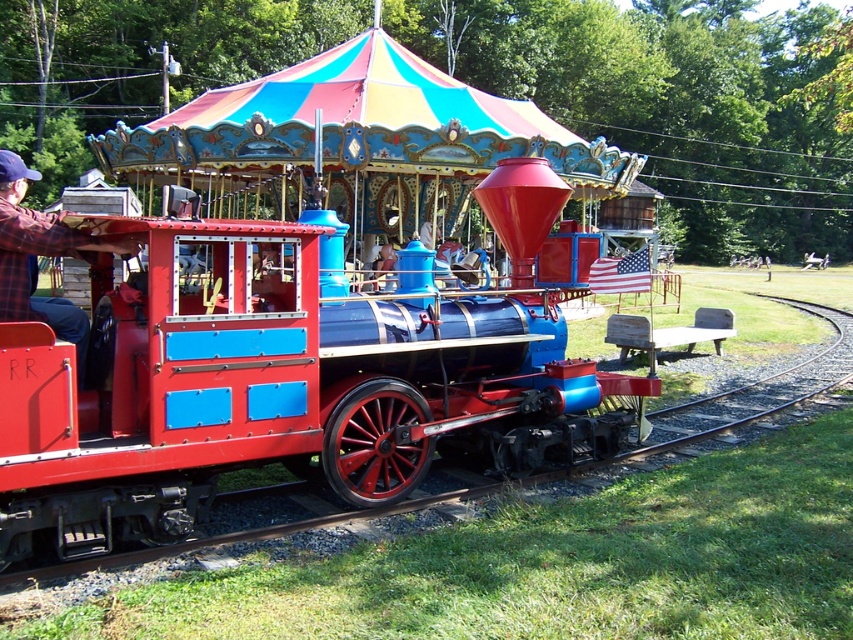
Question: In this image, where is shiny red locomotive at center located relative to plaid flannel shirt at left?

Choices:
 (A) left
 (B) right

Answer: (B)

Question: Can you confirm if shiny red locomotive at center is positioned to the left of plaid flannel shirt at left?

Choices:
 (A) yes
 (B) no

Answer: (B)

Question: Which point is closer to the camera?

Choices:
 (A) (41, 234)
 (B) (357, 394)

Answer: (A)

Question: Which of the following is the farthest from the observer?

Choices:
 (A) (106, 317)
 (B) (80, 371)

Answer: (A)

Question: Is shiny red locomotive at center to the right of plaid flannel shirt at left from the viewer's perspective?

Choices:
 (A) yes
 (B) no

Answer: (A)

Question: Which point appears closest to the camera in this image?

Choices:
 (A) (48, 435)
 (B) (65, 307)

Answer: (A)